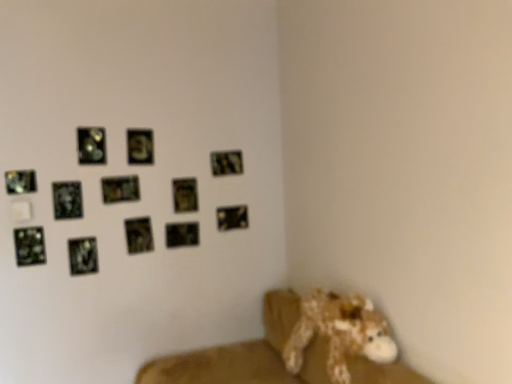
Question: From the image's perspective, relative to brown plush toy at lower right, is metallic silver picture frame at center, the seventh picture frame when ordered from left to right, above or below?

Choices:
 (A) above
 (B) below

Answer: (A)

Question: Is metallic silver picture frame at center, the seventh picture frame when ordered from left to right, inside or outside of brown plush toy at lower right?

Choices:
 (A) inside
 (B) outside

Answer: (B)

Question: Which of these objects is positioned closest to the metallic silver picture frame at upper center, which is the 4th picture frame in right-to-left order?

Choices:
 (A) metallic reflective picture frame at upper left, which is the first picture frame from left to right
 (B) fuzzy brown stuffed animal at lower right
 (C) metallic silver picture frame at center, the seventh picture frame when ordered from left to right
 (D) metallic silver picture frame at upper left, acting as the tenth picture frame starting from the right
 (E) metallic reflective picture frame at upper left, which is the 4th picture frame from left to right

Answer: (C)

Question: Based on their relative distances, which object is nearer to the metallic gold picture frame at upper center, which is the tenth picture frame in left-to-right order?

Choices:
 (A) fuzzy brown stuffed animal at lower right
 (B) metallic reflective picture frame at lower left, marked as the 2th picture frame in a left-to-right arrangement
 (C) metallic silver picture frame at upper right, arranged as the eleventh picture frame when viewed from the left
 (D) brown plush toy at lower right
 (E) metallic silver picture frame at upper center, which is the ninth picture frame from left to right

Answer: (E)